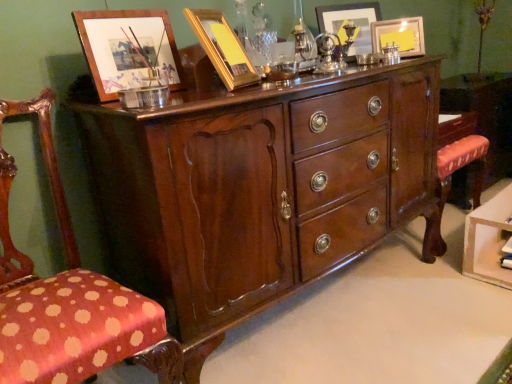
Question: Choose the correct answer: Is polka dot fabric chair at left inside matte gold picture frame at upper center, the fourth picture frame in the front-to-back sequence, or outside it?

Choices:
 (A) inside
 (B) outside

Answer: (B)

Question: Considering the positions of point (27, 301) and point (360, 48), is point (27, 301) closer or farther from the camera than point (360, 48)?

Choices:
 (A) farther
 (B) closer

Answer: (B)

Question: Which is farther from the matte gold picture frame at upper center, the 3th picture frame from the left?

Choices:
 (A) polka dot fabric chair at left
 (B) shiny brown wood chest of drawers at center
 (C) mahogany wood vanity at right
 (D) wooden picture frame at upper left, arranged as the 4th picture frame when viewed from the back
 (E) gold metallic picture frame at upper center, which is the second picture frame in front-to-back order

Answer: (A)

Question: Which object is positioned farthest from the gold metallic picture frame at upper center, the third picture frame in the right-to-left sequence?

Choices:
 (A) wooden picture frame at upper left, arranged as the 4th picture frame when viewed from the back
 (B) polka dot fabric chair at left
 (C) mahogany wood vanity at right
 (D) matte gold picture frame at upper right, placed as the 4th picture frame when sorted from left to right
 (E) matte gold picture frame at upper center, arranged as the 1th picture frame when viewed from the back

Answer: (C)